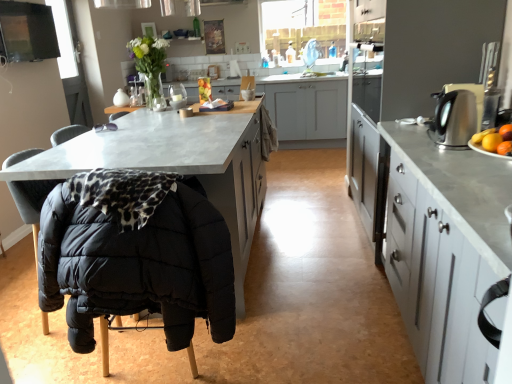
Locate an element on the screen. The image size is (512, 384). vacant area that lies to the right of black quilted fabric folding chair at lower left is located at coordinates (249, 346).